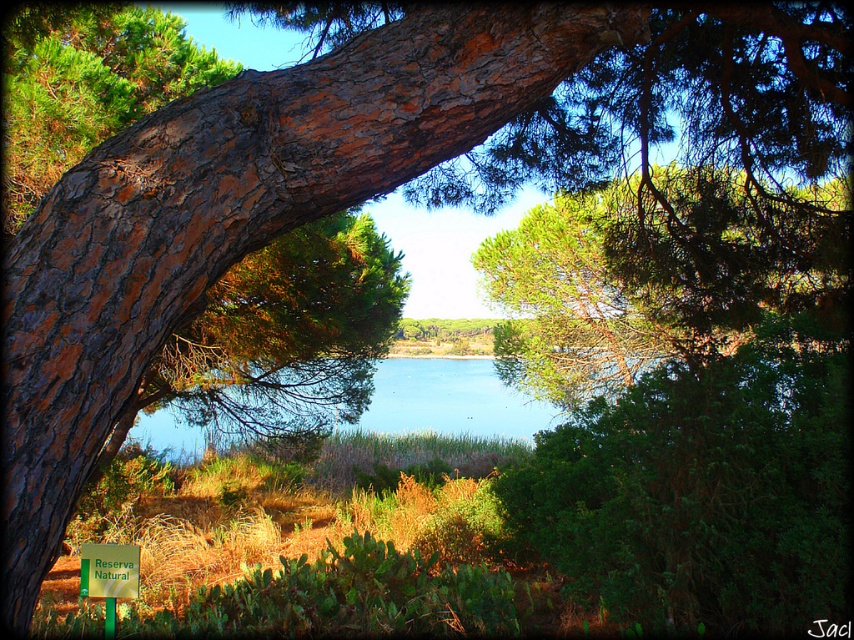
You are a hiker who wants to take a photo of the blue water at center and the green plastic sign at center. Which object should you focus on first if you want both to be in clear view?

The blue water at center is bigger than the green plastic sign at center, so focusing on the blue water at center will ensure both are in clear view since it takes up more space in the frame.

You are a hiker who wants to reach the blue water at center. You see the green plastic sign at center. Which direction should you move relative to the sign to get to the water?

The blue water at center is to the right of the green plastic sign at center, so you should move to the right of the green plastic sign at center to reach the blue water at center.

You are a hiker who wants to take a photo of the blue water at center and the green plastic sign at center. Which object should you focus on first to ensure both are in the frame?

The green plastic sign at center is behind the blue water at center, so you should focus on the blue water at center first to ensure both are in the frame.